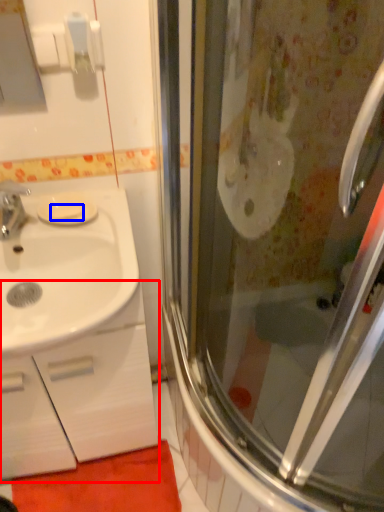
Question: Which object is further to the camera taking this photo, bathroom cabinet (highlighted by a red box) or soap (highlighted by a blue box)?

Choices:
 (A) bathroom cabinet
 (B) soap

Answer: (B)